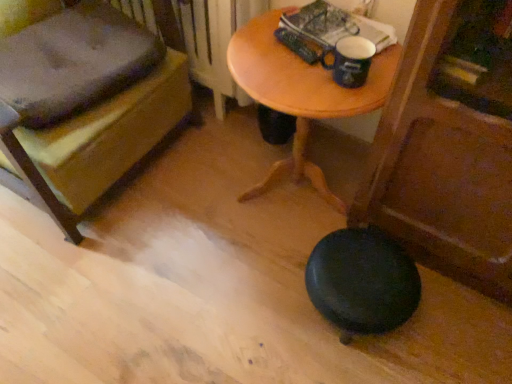
Question: From a real-world perspective, is blue ceramic mug at upper center located higher than black rubber stool at lower right?

Choices:
 (A) no
 (B) yes

Answer: (B)

Question: Considering the relative sizes of blue ceramic mug at upper center and black rubber stool at lower right in the image provided, is blue ceramic mug at upper center shorter than black rubber stool at lower right?

Choices:
 (A) yes
 (B) no

Answer: (A)

Question: From a real-world perspective, is blue ceramic mug at upper center below black rubber stool at lower right?

Choices:
 (A) yes
 (B) no

Answer: (B)

Question: Is blue ceramic mug at upper center not near black rubber stool at lower right?

Choices:
 (A) yes
 (B) no

Answer: (B)

Question: Could you tell me if blue ceramic mug at upper center is facing black rubber stool at lower right?

Choices:
 (A) no
 (B) yes

Answer: (A)

Question: From the image's perspective, would you say blue ceramic mug at upper center is shown under black rubber stool at lower right?

Choices:
 (A) yes
 (B) no

Answer: (B)

Question: Would you say black rubber stool at lower right is outside wooden table at center?

Choices:
 (A) no
 (B) yes

Answer: (B)

Question: Is black rubber stool at lower right behind wooden table at center?

Choices:
 (A) yes
 (B) no

Answer: (A)

Question: Are black rubber stool at lower right and wooden table at center beside each other?

Choices:
 (A) no
 (B) yes

Answer: (A)

Question: Can you confirm if black rubber stool at lower right is taller than wooden table at center?

Choices:
 (A) no
 (B) yes

Answer: (A)

Question: Considering the relative sizes of black rubber stool at lower right and wooden table at center in the image provided, is black rubber stool at lower right shorter than wooden table at center?

Choices:
 (A) no
 (B) yes

Answer: (B)

Question: Considering the relative positions of black rubber stool at lower right and wooden table at center in the image provided, is black rubber stool at lower right to the right of wooden table at center from the viewer's perspective?

Choices:
 (A) no
 (B) yes

Answer: (B)

Question: Is wooden bench at lower left looking in the opposite direction of black rubber stool at lower right?

Choices:
 (A) yes
 (B) no

Answer: (B)